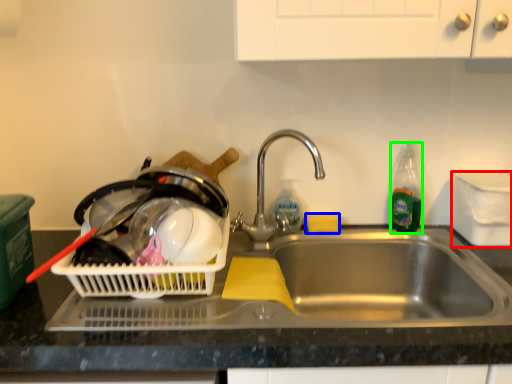
Question: Which is farther away from appliance (highlighted by a red box)? food (highlighted by a blue box) or bottle (highlighted by a green box)?

Choices:
 (A) food
 (B) bottle

Answer: (A)